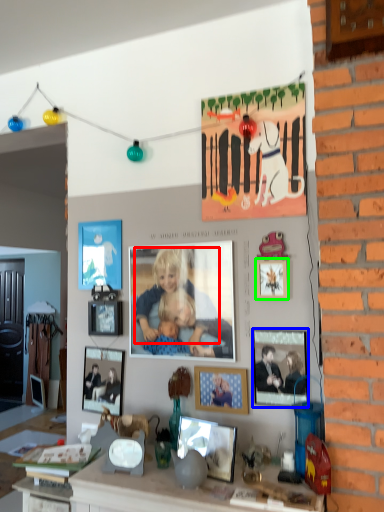
Question: Which object is the closest to the person (highlighted by a red box)? Choose among these: picture frame (highlighted by a blue box) or picture frame (highlighted by a green box).

Choices:
 (A) picture frame
 (B) picture frame

Answer: (B)